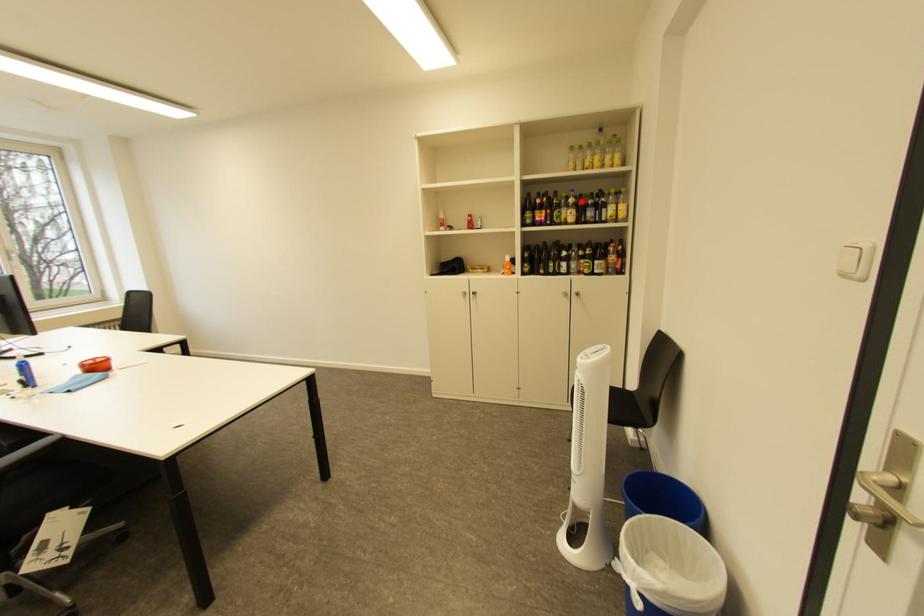
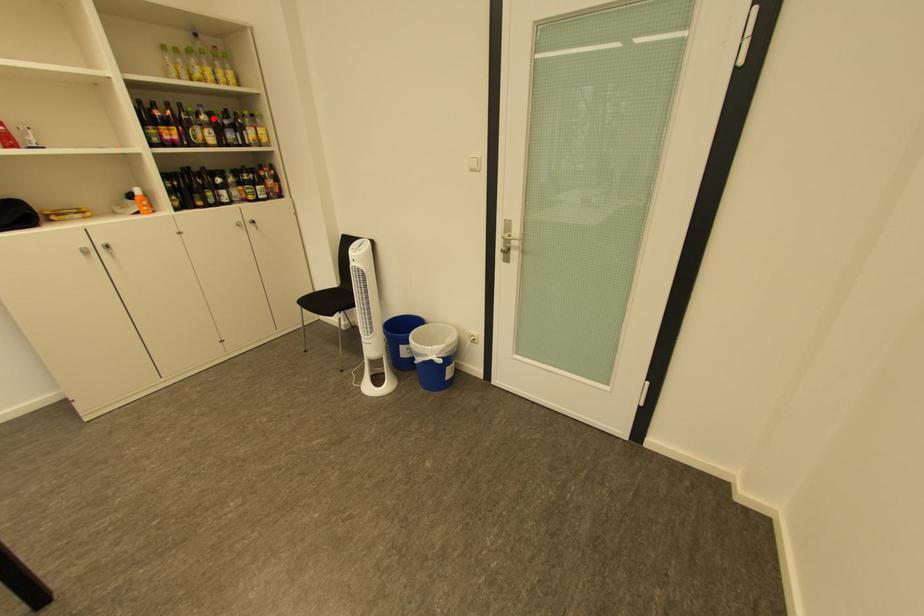
I am providing you with two images of the same scene from different viewpoints. A red point is marked on the first image and another point is marked on the second image. Are the points marked in image1 and image2 representing the same 3D position?

Yes